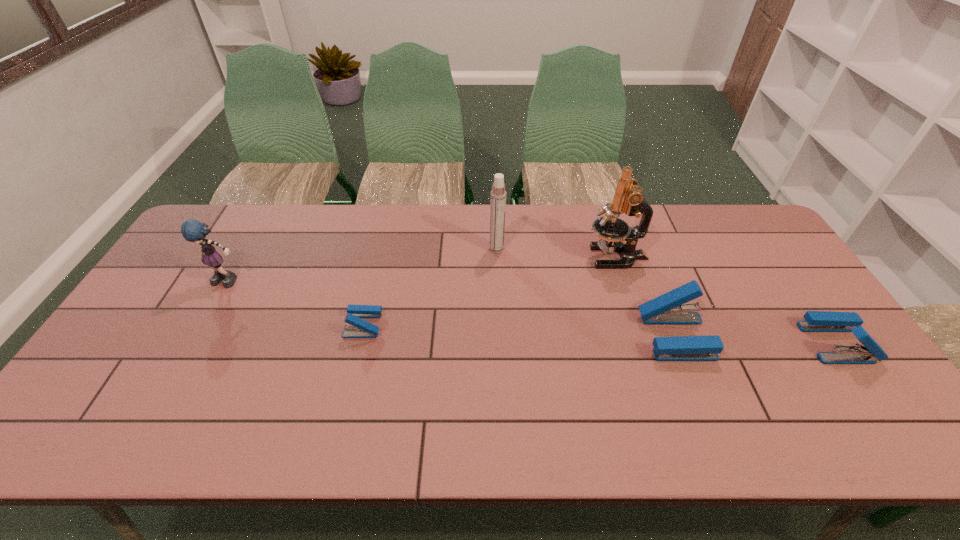
Locate an element on the screen. This screenshot has width=960, height=540. vacant point that satisfies the following two spatial constraints: 1. on the front-facing side of the third tallest object; 2. on the right side of the shortest stapler is located at coordinates (204, 325).

Find the location of a particular element. The image size is (960, 540). free location that satisfies the following two spatial constraints: 1. on the front-facing side of the shortest object; 2. on the left side of the third tallest object is located at coordinates (204, 325).

Image resolution: width=960 pixels, height=540 pixels. In order to click on free space that satisfies the following two spatial constraints: 1. on the front-facing side of the fourth nearest object; 2. on the left side of the rightmost object in this screenshot , I will do `click(195, 343)`.

I want to click on free region that satisfies the following two spatial constraints: 1. on the front-facing side of the third tallest object; 2. on the right side of the second shortest object, so click(195, 343).

The image size is (960, 540). I want to click on free space that satisfies the following two spatial constraints: 1. on the front-facing side of the second stapler from left to right; 2. on the right side of the third tallest object, so click(x=198, y=337).

The width and height of the screenshot is (960, 540). What are the coordinates of `blank space that satisfies the following two spatial constraints: 1. on the front side of the third object from left to right; 2. on the right side of the rightmost object` in the screenshot? It's located at (500, 343).

Where is `blank space that satisfies the following two spatial constraints: 1. on the front-facing side of the second object from left to right; 2. on the left side of the fourth nearest object`? blank space that satisfies the following two spatial constraints: 1. on the front-facing side of the second object from left to right; 2. on the left side of the fourth nearest object is located at coordinates (204, 325).

Identify the location of vacant position in the image that satisfies the following two spatial constraints: 1. at the eyepiece of the microscope; 2. on the right side of the rightmost stapler. The height and width of the screenshot is (540, 960). (644, 343).

Find the location of a particular element. blank space that satisfies the following two spatial constraints: 1. at the eyepiece of the microscope; 2. on the front-facing side of the leftmost object is located at coordinates (624, 281).